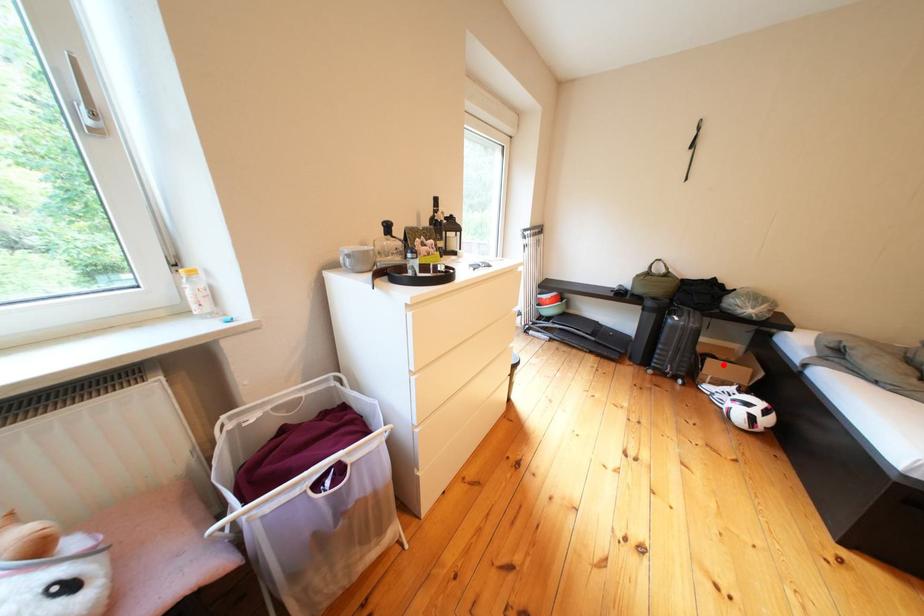
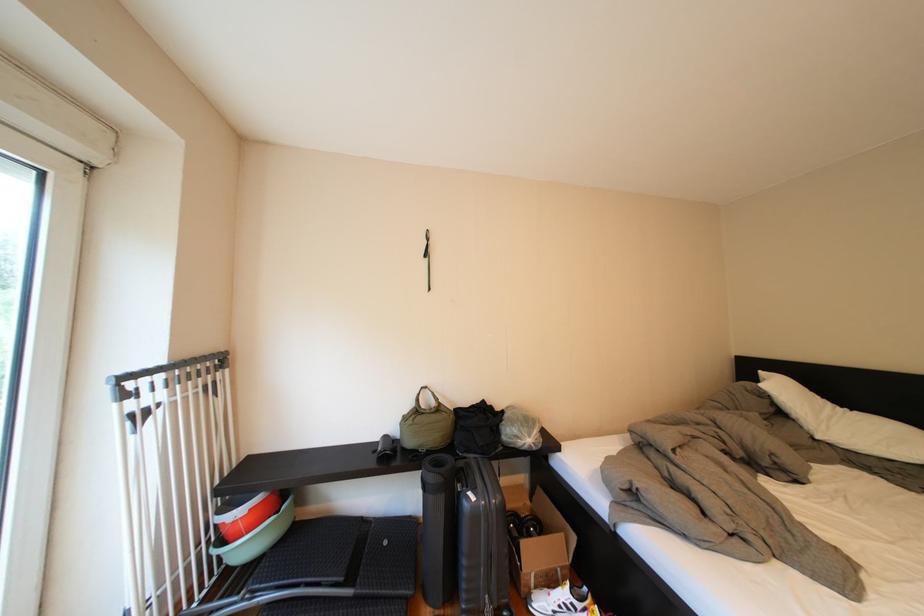
Question: I am providing you with two images of the same scene from different viewpoints. A red point is shown in image1. For the corresponding object point in image2, is it positioned nearer or farther from the camera?

Choices:
 (A) Nearer
 (B) Farther

Answer: (A)